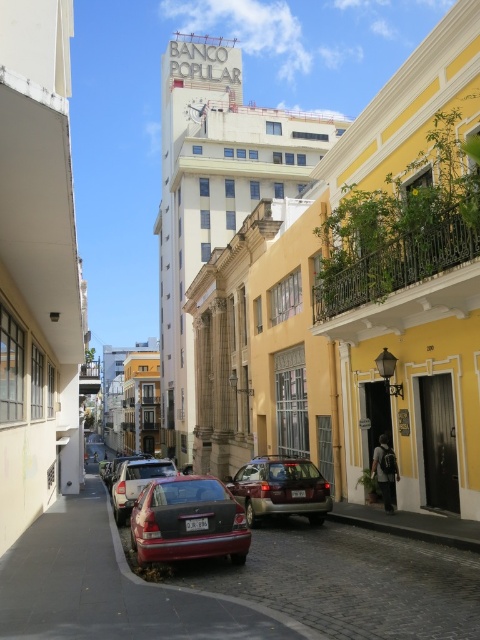
What do you see at coordinates (188, 522) in the screenshot?
I see `shiny red sedan at lower center` at bounding box center [188, 522].

Does shiny red sedan at lower center have a smaller size compared to matte red car at center?

Yes.

Measure the distance between shiny red sedan at lower center and camera.

shiny red sedan at lower center is 24.81 feet away from camera.

In order to click on shiny red sedan at lower center in this screenshot , I will do `click(188, 522)`.

From the picture: Is matte gray suv at center above matte red car at center?

Yes.

Is matte gray suv at center positioned at the back of matte red car at center?

No, it is not.

At what (x,y) coordinates should I click in order to perform the action: click on matte gray suv at center. Please return your answer as a coordinate pair (x, y). The height and width of the screenshot is (640, 480). Looking at the image, I should click on (280, 488).

Locate an element on the screen. This screenshot has height=640, width=480. matte gray suv at center is located at coordinates (280, 488).

Which is below, shiny red sedan at lower center or matte gray suv at center?

Positioned lower is matte gray suv at center.

Which is more to the right, shiny red sedan at lower center or matte gray suv at center?

From the viewer's perspective, matte gray suv at center appears more on the right side.

Between point (215, 483) and point (275, 456), which one is positioned in front?

Positioned in front is point (215, 483).

At what (x,y) coordinates should I click in order to perform the action: click on shiny red sedan at lower center. Please return your answer as a coordinate pair (x, y). Looking at the image, I should click on [188, 522].